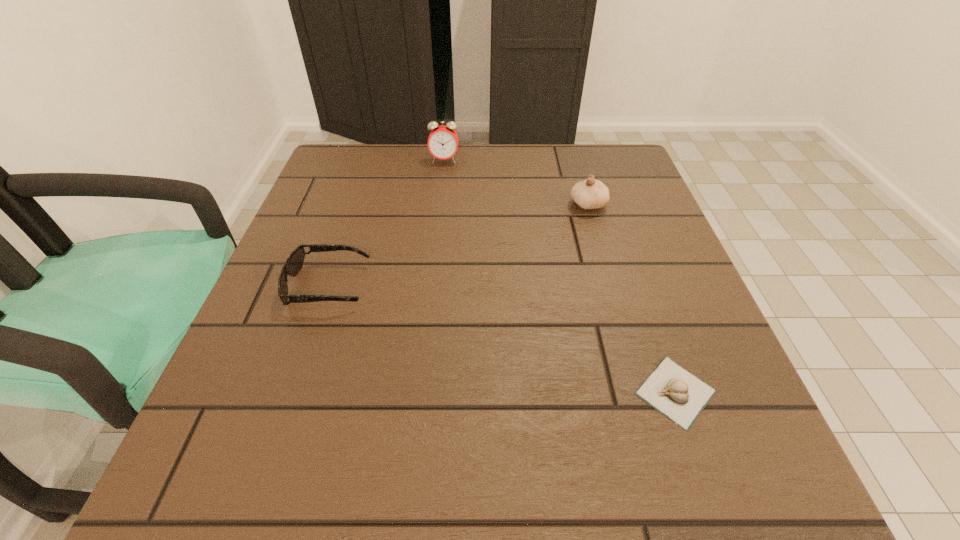
This screenshot has width=960, height=540. In order to click on free space located 0.100m on the front-facing side of the leftmost object in this screenshot , I will do `click(420, 286)`.

The height and width of the screenshot is (540, 960). I want to click on vacant point located on the left of the shorter garlic, so click(x=594, y=392).

Identify the location of alarm clock at the far edge. The image size is (960, 540). (443, 141).

The image size is (960, 540). Identify the location of garlic that is positioned at the far edge. (589, 194).

At what (x,y) coordinates should I click in order to perform the action: click on object situated at the left edge. Please return your answer as a coordinate pair (x, y). Looking at the image, I should click on (294, 263).

At what (x,y) coordinates should I click in order to perform the action: click on object at the far right corner. Please return your answer as a coordinate pair (x, y). The height and width of the screenshot is (540, 960). Looking at the image, I should click on pyautogui.click(x=589, y=194).

Image resolution: width=960 pixels, height=540 pixels. In the image, there is a desktop. Find the location of `vacant space at the far edge`. vacant space at the far edge is located at coordinates (410, 179).

The height and width of the screenshot is (540, 960). Find the location of `vacant space at the left edge`. vacant space at the left edge is located at coordinates (249, 371).

Find the location of a particular element. The width and height of the screenshot is (960, 540). blank space at the right edge of the desktop is located at coordinates (671, 251).

In the image, there is a desktop. At what (x,y) coordinates should I click in order to perform the action: click on vacant space at the far left corner. Please return your answer as a coordinate pair (x, y). The height and width of the screenshot is (540, 960). Looking at the image, I should click on (376, 177).